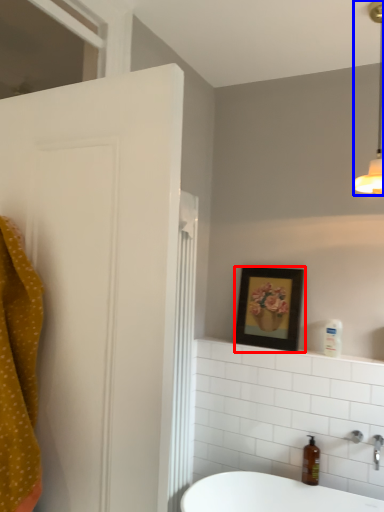
Question: Which object appears closest to the camera in this image, picture frame (highlighted by a red box) or light fixture (highlighted by a blue box)?

Choices:
 (A) picture frame
 (B) light fixture

Answer: (B)